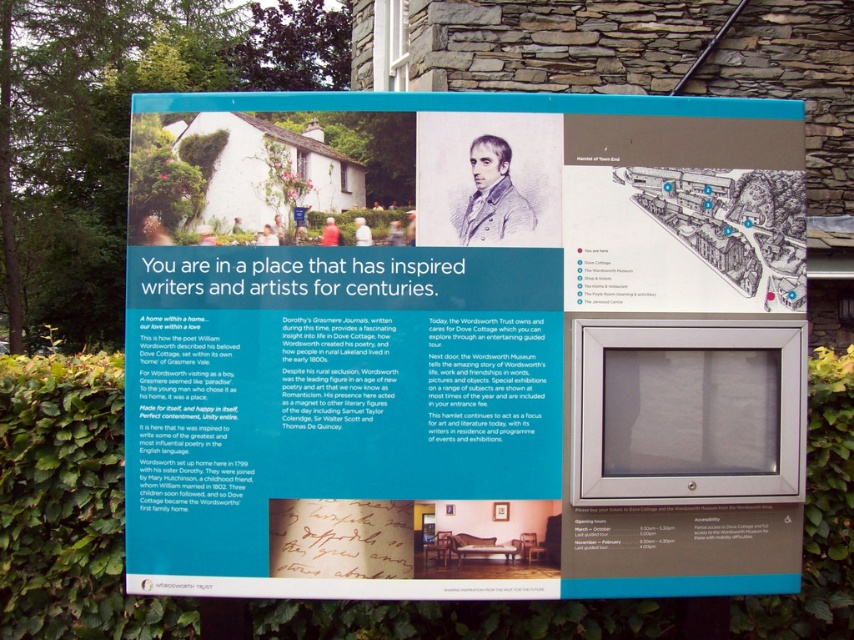
Is white paper at center shorter than green leafy hedge at lower left?

In fact, white paper at center may be taller than green leafy hedge at lower left.

Does point (613, 253) come closer to viewer compared to point (63, 458)?

Yes, point (613, 253) is in front of point (63, 458).

This screenshot has width=854, height=640. What do you see at coordinates (477, 356) in the screenshot? I see `white paper at center` at bounding box center [477, 356].

Find the location of a particular element. Image resolution: width=854 pixels, height=640 pixels. white paper at center is located at coordinates (477, 356).